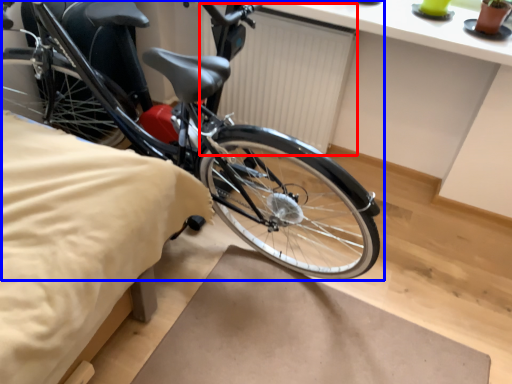
Question: Which object appears closest to the camera in this image, radiator (highlighted by a red box) or bicycle (highlighted by a blue box)?

Choices:
 (A) radiator
 (B) bicycle

Answer: (B)